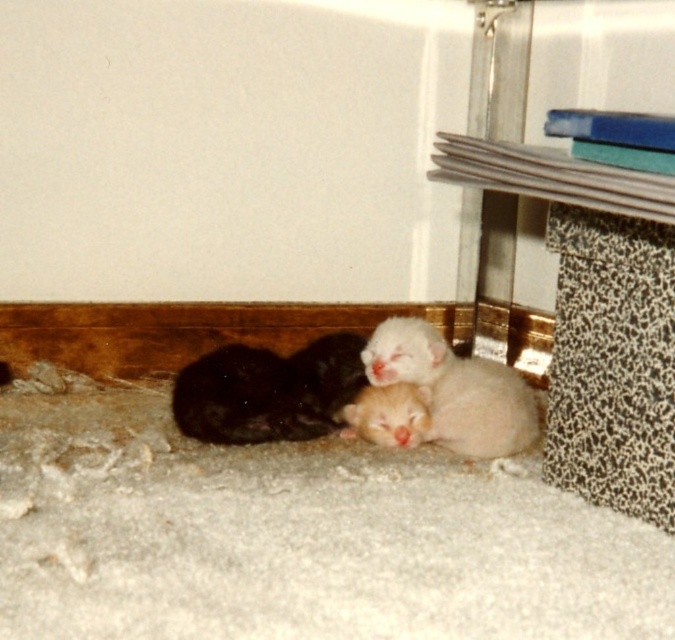
Is soft fur kitten at lower left to the left of fluffy white kitten at lower center from the viewer's perspective?

Yes, soft fur kitten at lower left is to the left of fluffy white kitten at lower center.

Is the position of soft fur kitten at lower left more distant than that of fluffy white kitten at lower center?

Yes.

What do you see at coordinates (269, 392) in the screenshot? I see `soft fur kitten at lower left` at bounding box center [269, 392].

Locate an element on the screen. This screenshot has height=640, width=675. soft fur kitten at lower left is located at coordinates (269, 392).